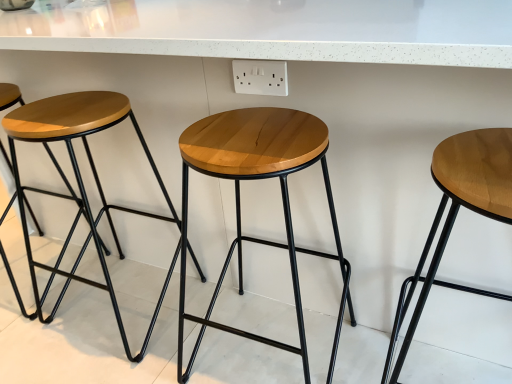
Question: Should I look upward or downward to see wooden stool at left, which is the 2th stool from left to right?

Choices:
 (A) down
 (B) up

Answer: (A)

Question: Considering the relative sizes of wooden stool at left, acting as the third stool starting from the right, and light brown wood stool at right, which is counted as the 1th stool, starting from the right, in the image provided, is wooden stool at left, acting as the third stool starting from the right, shorter than light brown wood stool at right, which is counted as the 1th stool, starting from the right,?

Choices:
 (A) no
 (B) yes

Answer: (A)

Question: Considering the relative sizes of wooden stool at left, acting as the third stool starting from the right, and light brown wood stool at right, which is counted as the 1th stool, starting from the right, in the image provided, is wooden stool at left, acting as the third stool starting from the right, bigger than light brown wood stool at right, which is counted as the 1th stool, starting from the right,?

Choices:
 (A) no
 (B) yes

Answer: (B)

Question: Is wooden stool at left, which is the 2th stool from left to right, not near light brown wood stool at right, which is counted as the 1th stool, starting from the right?

Choices:
 (A) yes
 (B) no

Answer: (B)

Question: Does wooden stool at left, which is the 2th stool from left to right, have a lesser width compared to light brown wood stool at right, arranged as the 4th stool when viewed from the left?

Choices:
 (A) no
 (B) yes

Answer: (B)

Question: Is wooden stool at left, acting as the third stool starting from the right, smaller than light brown wood stool at right, which is counted as the 1th stool, starting from the right?

Choices:
 (A) yes
 (B) no

Answer: (B)

Question: Is wooden stool at left, which is the 2th stool from left to right, located outside light brown wood stool at right, arranged as the 4th stool when viewed from the left?

Choices:
 (A) yes
 (B) no

Answer: (A)

Question: Could you tell me if matte wood stool at left, the first stool positioned from the left, is facing wooden stool at left, acting as the third stool starting from the right?

Choices:
 (A) yes
 (B) no

Answer: (B)

Question: Does matte wood stool at left, the first stool positioned from the left, have a lesser height compared to wooden stool at left, which is the 2th stool from left to right?

Choices:
 (A) no
 (B) yes

Answer: (A)

Question: From a real-world perspective, is matte wood stool at left, the first stool positioned from the left, positioned under wooden stool at left, acting as the third stool starting from the right, based on gravity?

Choices:
 (A) no
 (B) yes

Answer: (A)

Question: Can you confirm if matte wood stool at left, the first stool positioned from the left, is taller than wooden stool at left, acting as the third stool starting from the right?

Choices:
 (A) no
 (B) yes

Answer: (B)

Question: From the image's perspective, is matte wood stool at left, the first stool positioned from the left, located above wooden stool at left, which is the 2th stool from left to right?

Choices:
 (A) no
 (B) yes

Answer: (B)

Question: Is matte wood stool at left, the first stool positioned from the left, thinner than wooden stool at left, which is the 2th stool from left to right?

Choices:
 (A) yes
 (B) no

Answer: (B)

Question: Is light brown wood stool at right, which is counted as the 1th stool, starting from the right, with natural wood stool at center, the second stool positioned from the right?

Choices:
 (A) yes
 (B) no

Answer: (B)